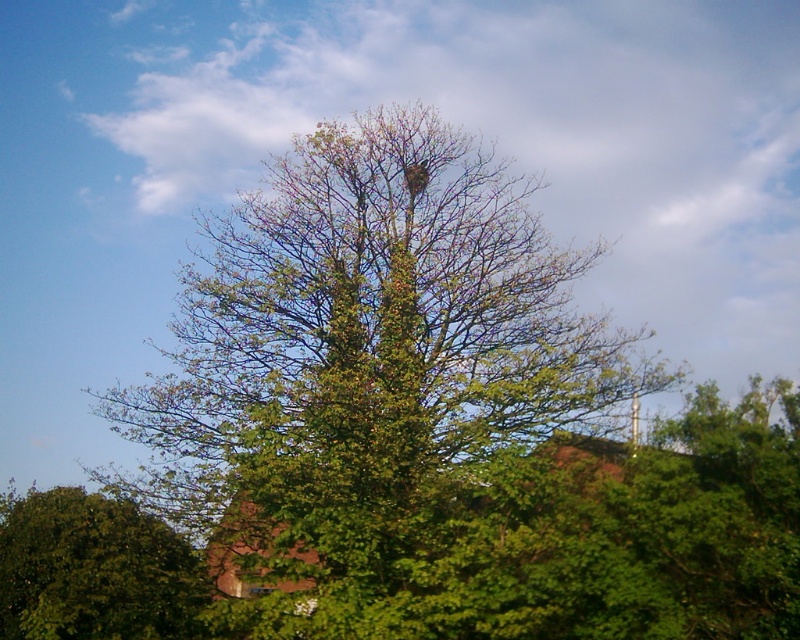
Question: Which point is farther to the camera?

Choices:
 (A) (4, 552)
 (B) (402, 248)

Answer: (B)

Question: Can you confirm if green leafy tree at center is bigger than green leafy tree at lower left?

Choices:
 (A) yes
 (B) no

Answer: (A)

Question: Does green leafy tree at center appear on the right side of green leafy tree at lower left?

Choices:
 (A) no
 (B) yes

Answer: (B)

Question: Is green leafy tree at center above green leafy tree at lower left?

Choices:
 (A) no
 (B) yes

Answer: (B)

Question: Among these objects, which one is nearest to the camera?

Choices:
 (A) green leafy tree at lower left
 (B) green leafy tree at center

Answer: (B)